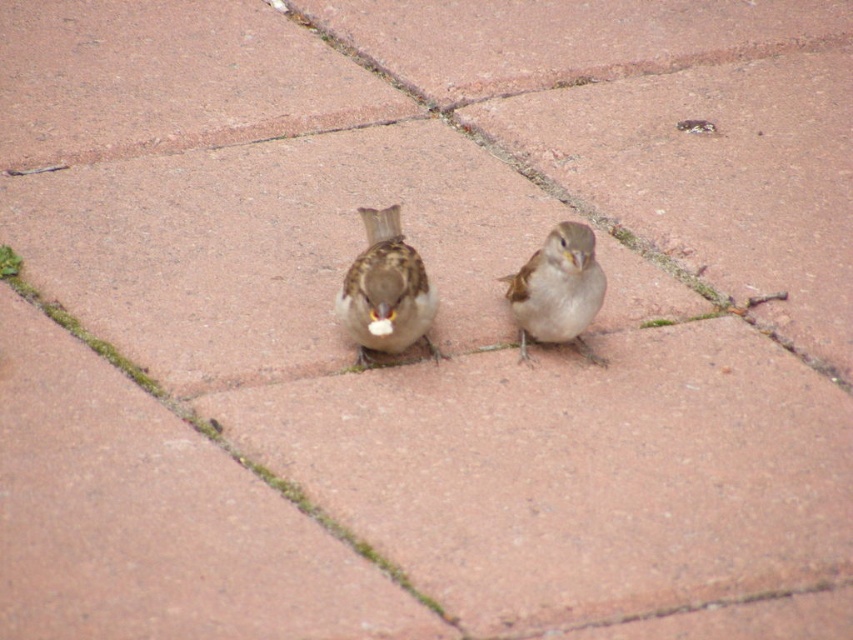
Question: Observing the image, what is the correct spatial positioning of brown matte sparrow at center in reference to brown feathered sparrow at center?

Choices:
 (A) below
 (B) above

Answer: (A)

Question: Does brown matte sparrow at center appear on the left side of brown feathered sparrow at center?

Choices:
 (A) yes
 (B) no

Answer: (A)

Question: Does brown matte sparrow at center appear on the left side of brown feathered sparrow at center?

Choices:
 (A) yes
 (B) no

Answer: (A)

Question: Which object appears closest to the camera in this image?

Choices:
 (A) brown feathered sparrow at center
 (B) brown matte sparrow at center

Answer: (B)